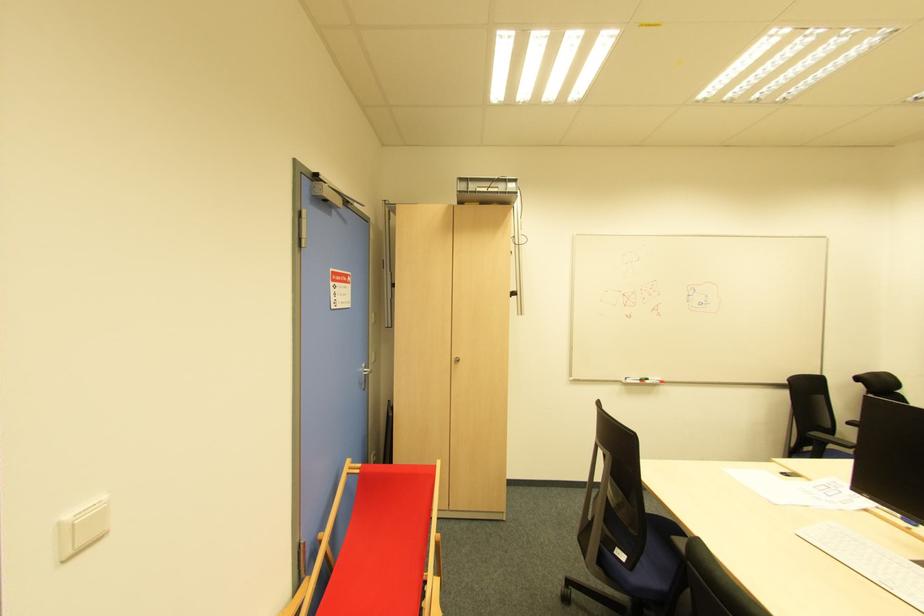
Where would you turn the silver door handle? Please return your answer as a coordinate pair (x, y).

(370, 376)